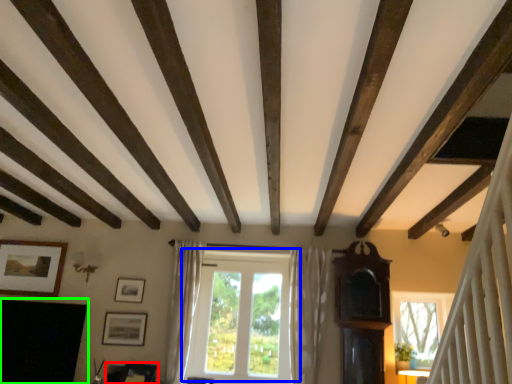
Question: Which object is the closest to the furniture (highlighted by a red box)? Choose among these: window (highlighted by a blue box) or fireplace (highlighted by a green box).

Choices:
 (A) window
 (B) fireplace

Answer: (B)